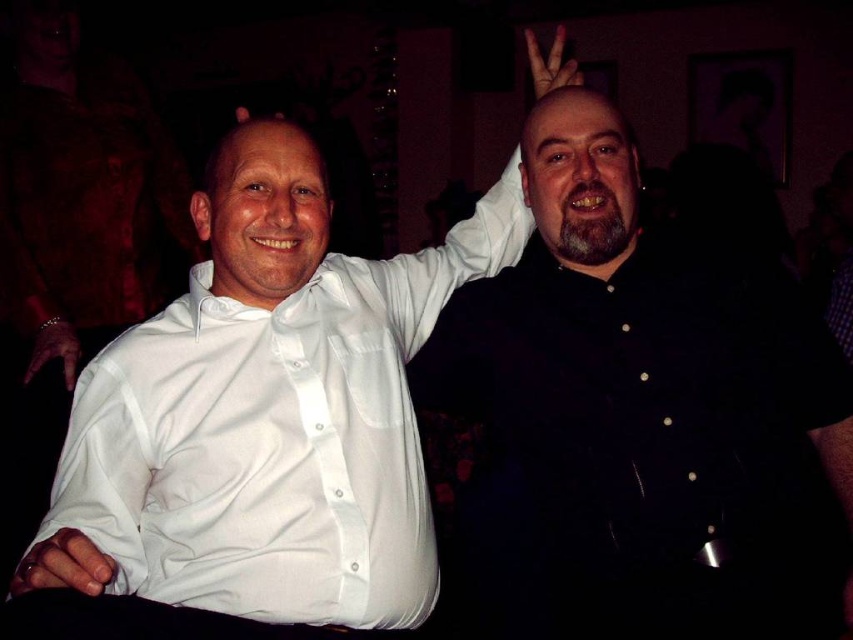
Based on the photo, you are at a party and want to take a photo of the black matte shirt at right and the metallic bracelet at lower left. Which object should you focus on first to ensure both are in the frame?

The black matte shirt at right is in front of the metallic bracelet at lower left, so you should focus on the metallic bracelet at lower left first to ensure both are in the frame.

You are standing in the social setting shown in the image and want to determine which of the two points, point (621, 232) or point (61, 317), is nearer to you. Based on the spatial relationships in the scene, which point is closer?

Point (621, 232) is closer to the viewer than point (61, 317).